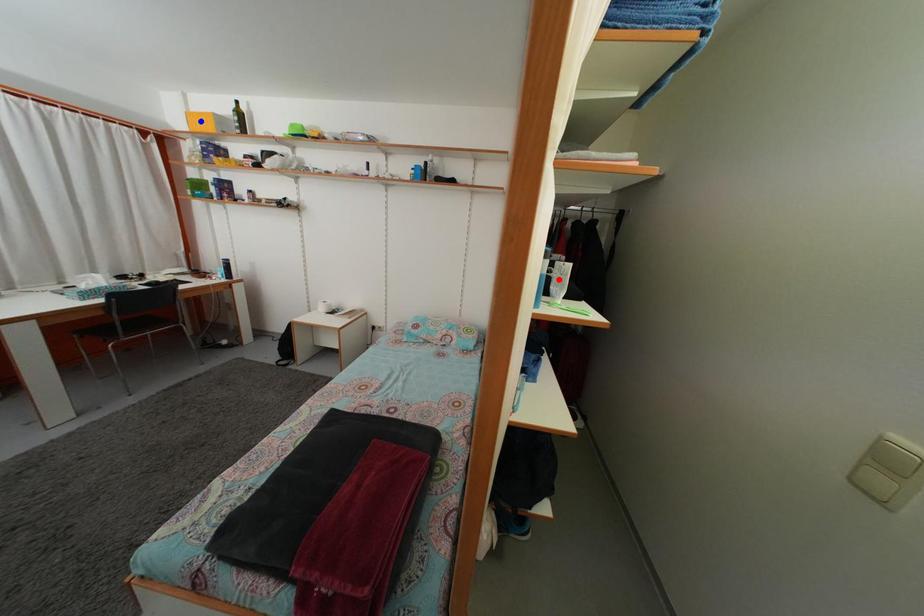
Question: Which of the two points in the image is closer to the camera?

Choices:
 (A) Blue point is closer.
 (B) Red point is closer.

Answer: (B)